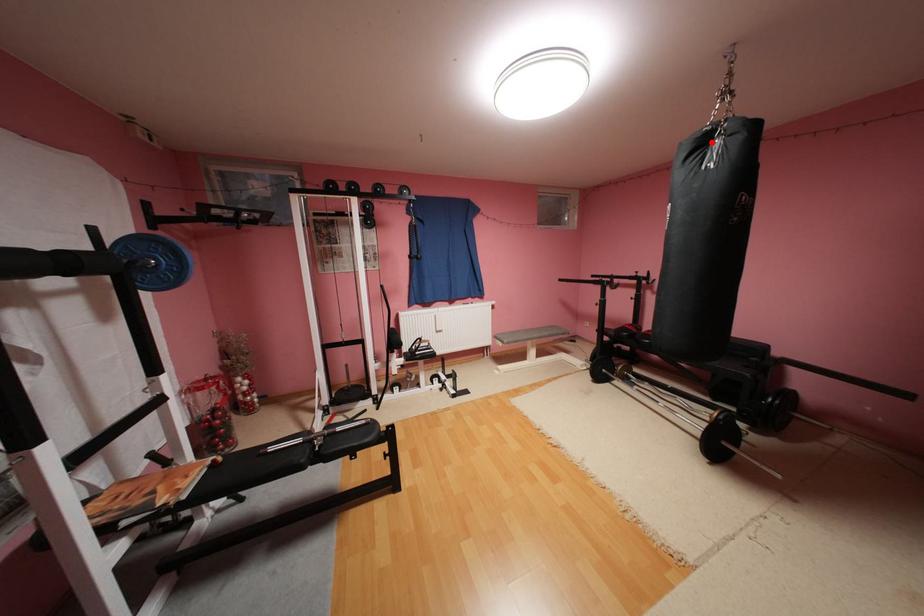
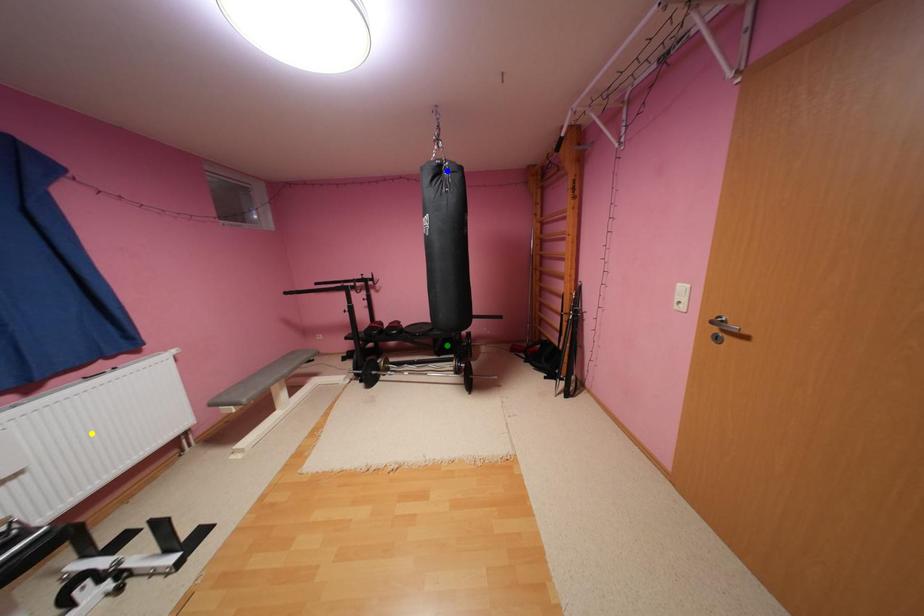
Question: I am providing you with two images of the same scene from different viewpoints. A red point is marked on the first image. You are given multiple points on the second image. Can you choose the point in image 2 that corresponds to the point in image 1?

Choices:
 (A) blue point
 (B) green point
 (C) yellow point

Answer: (A)